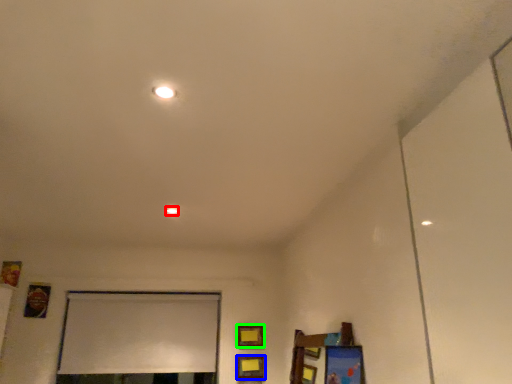
Question: Which object is positioned closest to light (highlighted by a red box)? Select from picture frame (highlighted by a blue box) and picture frame (highlighted by a green box).

Choices:
 (A) picture frame
 (B) picture frame

Answer: (B)